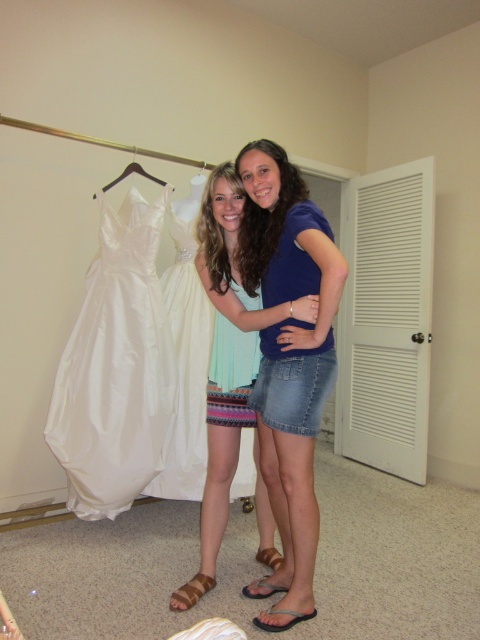
You are a fashion designer who wants to create a new outfit that combines elements from both the denim skirt at center and the black fabric sandal at lower center. Considering their sizes, which object should you use as the base for the larger part of the outfit?

The denim skirt at center has a larger size compared to the black fabric sandal at lower center, so you should use the denim skirt at center as the base for the larger part of the outfit.

You are standing in a fitting room and see two points marked on the wall. The first point is at position point (292, 385) and the second is at point (297, 616). Which point is closer to you?

Point (292, 385) is closer to the camera than point (297, 616), so the first point is closer to you.